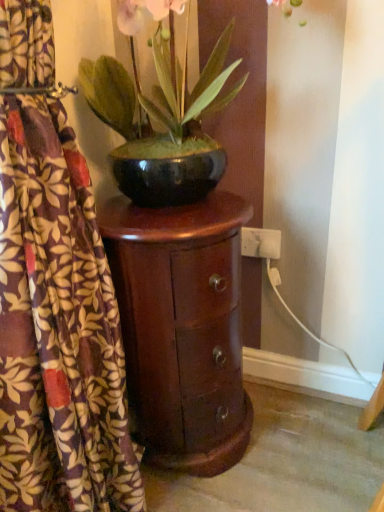
Question: Considering the relative sizes of printed fabric curtain at left and green glossy bowl at center in the image provided, is printed fabric curtain at left thinner than green glossy bowl at center?

Choices:
 (A) yes
 (B) no

Answer: (A)

Question: Can you confirm if printed fabric curtain at left is positioned to the left of green glossy bowl at center?

Choices:
 (A) yes
 (B) no

Answer: (A)

Question: Is printed fabric curtain at left closer to camera compared to green glossy bowl at center?

Choices:
 (A) yes
 (B) no

Answer: (A)

Question: Does printed fabric curtain at left have a greater width compared to green glossy bowl at center?

Choices:
 (A) no
 (B) yes

Answer: (A)

Question: From the image's perspective, is printed fabric curtain at left beneath green glossy bowl at center?

Choices:
 (A) yes
 (B) no

Answer: (A)

Question: Is printed fabric curtain at left not within green glossy bowl at center?

Choices:
 (A) no
 (B) yes

Answer: (B)

Question: From the image's perspective, is printed fabric curtain at left over glossy wood nightstand at left?

Choices:
 (A) yes
 (B) no

Answer: (A)

Question: Is printed fabric curtain at left positioned with its back to glossy wood nightstand at left?

Choices:
 (A) yes
 (B) no

Answer: (B)

Question: Considering the relative sizes of printed fabric curtain at left and glossy wood nightstand at left in the image provided, is printed fabric curtain at left shorter than glossy wood nightstand at left?

Choices:
 (A) yes
 (B) no

Answer: (B)

Question: From a real-world perspective, is printed fabric curtain at left over glossy wood nightstand at left?

Choices:
 (A) no
 (B) yes

Answer: (B)

Question: Is printed fabric curtain at left to the right of glossy wood nightstand at left from the viewer's perspective?

Choices:
 (A) no
 (B) yes

Answer: (A)

Question: Does printed fabric curtain at left lie in front of glossy wood nightstand at left?

Choices:
 (A) no
 (B) yes

Answer: (B)

Question: Does glossy wood nightstand at left appear on the right side of green glossy bowl at center?

Choices:
 (A) yes
 (B) no

Answer: (B)